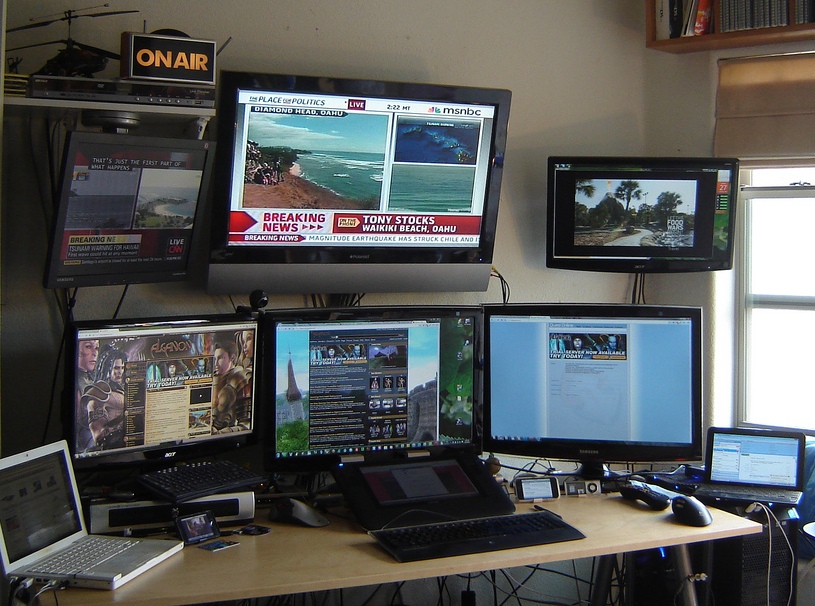
Locate an element on the screen. window is located at coordinates (780, 335).